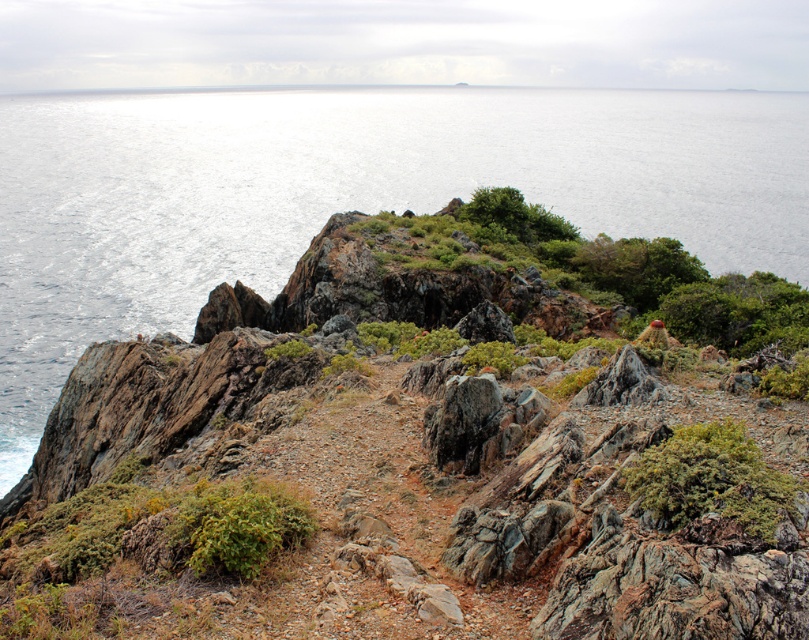
Question: Can you confirm if glistening silver water at upper left is bigger than rusty metallic rock at center?

Choices:
 (A) yes
 (B) no

Answer: (A)

Question: Which object is closer to the camera taking this photo?

Choices:
 (A) green fuzzy bush at center right
 (B) rusty metallic rock at center

Answer: (A)

Question: Which object is the closest to the glistening silver water at upper left?

Choices:
 (A) rusty metallic rock at center
 (B) green fuzzy bush at center right

Answer: (A)

Question: Estimate the real-world distances between objects in this image. Which object is closer to the rusty metallic rock at center?

Choices:
 (A) glistening silver water at upper left
 (B) green fuzzy bush at center right

Answer: (B)

Question: Where is green fuzzy bush at center right located in relation to rusty metallic rock at center in the image?

Choices:
 (A) below
 (B) above

Answer: (A)

Question: Is green fuzzy bush at center right thinner than rusty metallic rock at center?

Choices:
 (A) yes
 (B) no

Answer: (A)